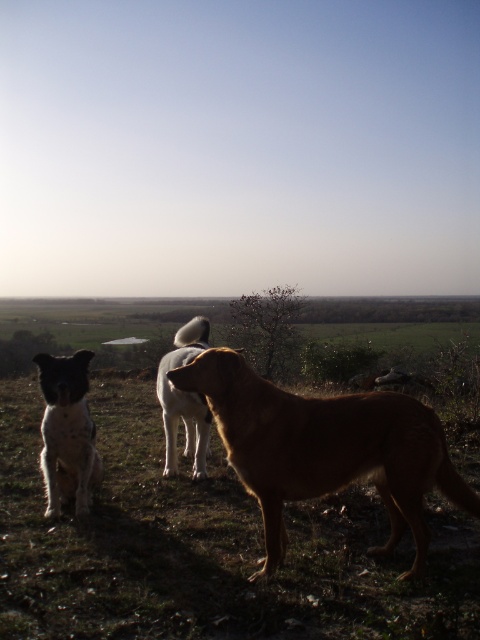
Does white fur dog at left have a lesser width compared to white fur dog at center?

No.

Find the location of a particular element. Image resolution: width=480 pixels, height=640 pixels. white fur dog at left is located at coordinates (67, 433).

Looking at this image, can you confirm if brown furry dog at center is positioned to the left of white fur dog at left?

In fact, brown furry dog at center is to the right of white fur dog at left.

Can you confirm if brown furry dog at center is positioned below white fur dog at left?

Actually, brown furry dog at center is above white fur dog at left.

Between point (343, 417) and point (64, 480), which one is positioned in front?

Positioned in front is point (343, 417).

The image size is (480, 640). I want to click on brown furry dog at center, so click(325, 449).

Can you confirm if brown furry dog at center is positioned to the right of white fur dog at center?

Indeed, brown furry dog at center is positioned on the right side of white fur dog at center.

Is point (300, 474) positioned before point (175, 440)?

Yes, point (300, 474) is in front of point (175, 440).

What do you see at coordinates (325, 449) in the screenshot?
I see `brown furry dog at center` at bounding box center [325, 449].

Identify the location of brown furry dog at center. (325, 449).